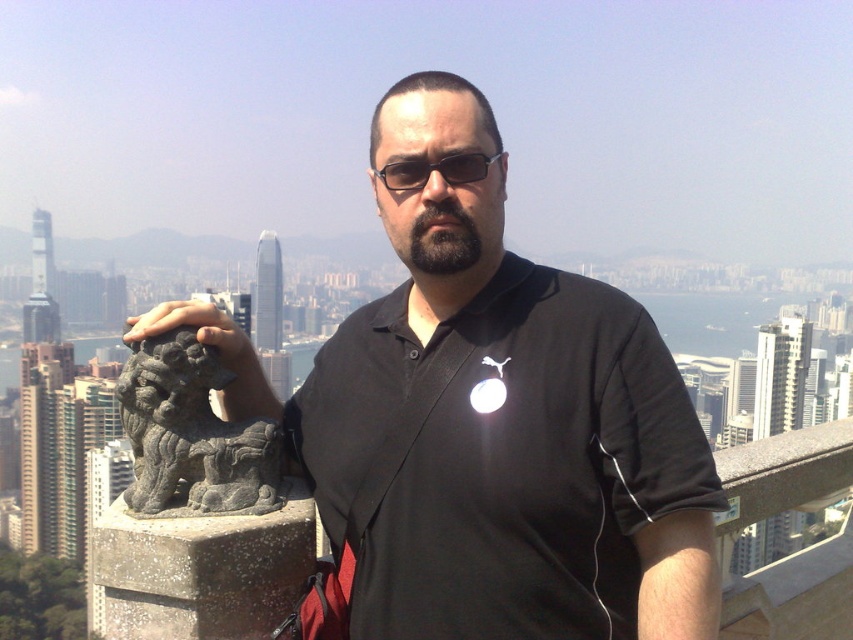
Which is in front, point (560, 636) or point (476, 173)?

Point (560, 636)

Consider the image. Is black matte shirt at center taller than sunglasses at center?

Yes, black matte shirt at center is taller than sunglasses at center.

Locate an element on the screen. black matte shirt at center is located at coordinates pos(490,420).

Locate an element on the screen. This screenshot has height=640, width=853. black matte shirt at center is located at coordinates (490, 420).

Is point (625, 442) positioned in front of point (149, 512)?

No, (625, 442) is behind (149, 512).

Does black matte shirt at center have a greater height compared to gray stone lion at left?

Correct, black matte shirt at center is much taller as gray stone lion at left.

Describe the element at coordinates (490, 420) in the screenshot. The width and height of the screenshot is (853, 640). I see `black matte shirt at center` at that location.

Where is `black matte shirt at center`? Image resolution: width=853 pixels, height=640 pixels. black matte shirt at center is located at coordinates (490, 420).

Is gray stone lion at left to the left of sunglasses at center from the viewer's perspective?

Indeed, gray stone lion at left is positioned on the left side of sunglasses at center.

Can you confirm if gray stone lion at left is smaller than sunglasses at center?

No, gray stone lion at left is not smaller than sunglasses at center.

Where is `gray stone lion at left`? This screenshot has height=640, width=853. gray stone lion at left is located at coordinates (192, 435).